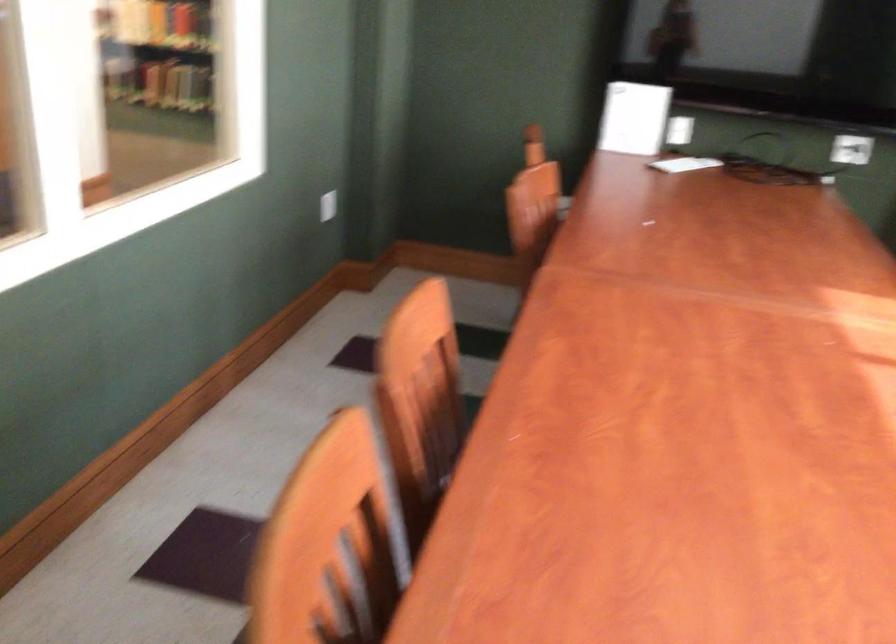
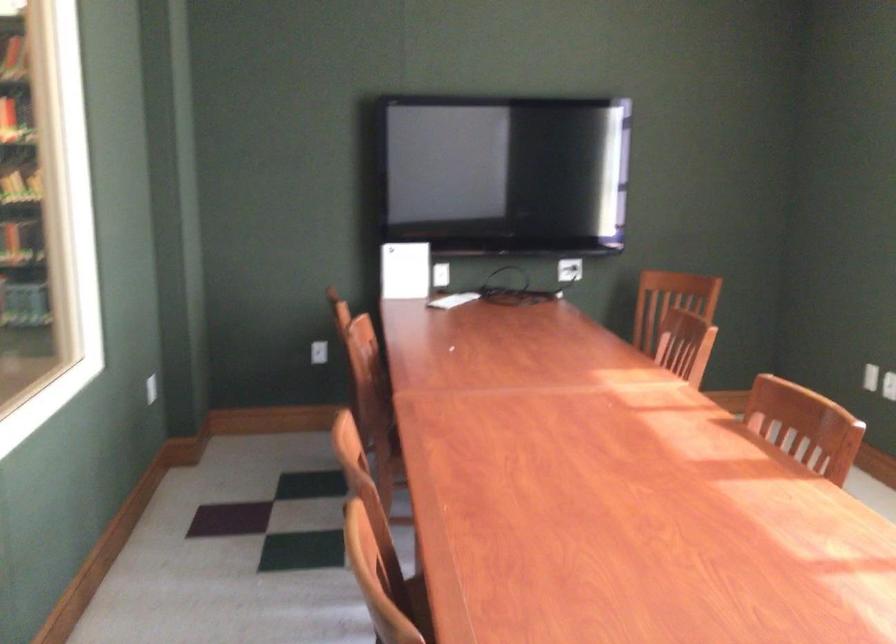
Question: How did the camera likely rotate?

Choices:
 (A) Left
 (B) Right
 (C) Up
 (D) Down

Answer: (B)